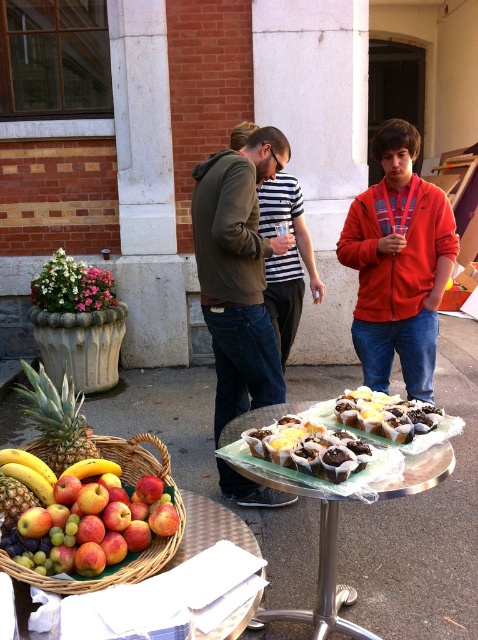
Question: Where is matte red hoodie at center located in relation to woven brown basket at lower left in the image?

Choices:
 (A) above
 (B) below

Answer: (A)

Question: Is silver metallic table at center above woven brown basket at lower left?

Choices:
 (A) no
 (B) yes

Answer: (A)

Question: Which point is farther from the camera taking this photo?

Choices:
 (A) (438, 456)
 (B) (325, 448)

Answer: (A)

Question: Which point is closer to the camera?

Choices:
 (A) (253, 301)
 (B) (105, 451)
 (C) (434, 228)
 (D) (344, 589)

Answer: (B)

Question: Which point appears closest to the camera in this image?

Choices:
 (A) (20, 572)
 (B) (242, 406)

Answer: (A)

Question: Does matte brown hoodie at center appear under chocolate cake at center?

Choices:
 (A) yes
 (B) no

Answer: (B)